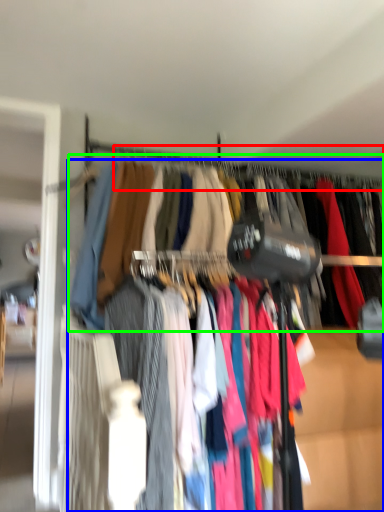
Question: Based on their relative distances, which object is farther from clothesline (highlighted by a red box)? Choose from trousers (highlighted by a blue box) and closet (highlighted by a green box).

Choices:
 (A) trousers
 (B) closet

Answer: (A)